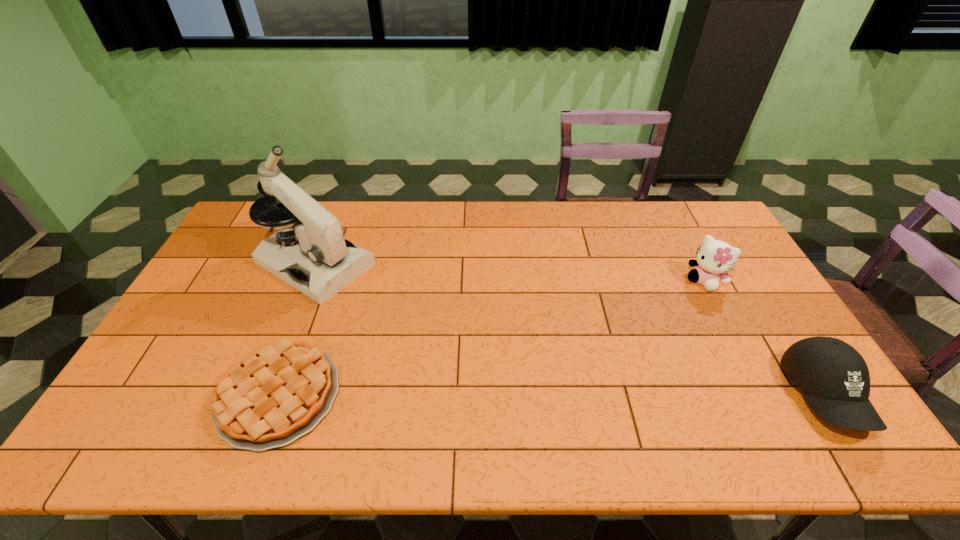
Locate an element on the screen. Image resolution: width=960 pixels, height=540 pixels. the shortest object is located at coordinates (272, 396).

Identify the location of the rightmost object. (835, 379).

Identify the location of baseball cap. (835, 379).

At what (x,y) coordinates should I click in order to perform the action: click on the second object from right to left. Please return your answer as a coordinate pair (x, y). The image size is (960, 540). Looking at the image, I should click on (714, 258).

Identify the location of the third shortest object. (714, 258).

Find the location of a particular element. The height and width of the screenshot is (540, 960). microscope is located at coordinates (323, 263).

Locate an element on the screen. vacant space situated on the right of the pie is located at coordinates (426, 395).

In order to click on vacant region located on the front-facing side of the third object from left to right in this screenshot , I will do `click(681, 306)`.

Where is `blank area located on the front-facing side of the third object from left to right`? The width and height of the screenshot is (960, 540). blank area located on the front-facing side of the third object from left to right is located at coordinates (680, 308).

Where is `free space located 0.070m on the front-facing side of the third object from left to right`? The image size is (960, 540). free space located 0.070m on the front-facing side of the third object from left to right is located at coordinates (685, 301).